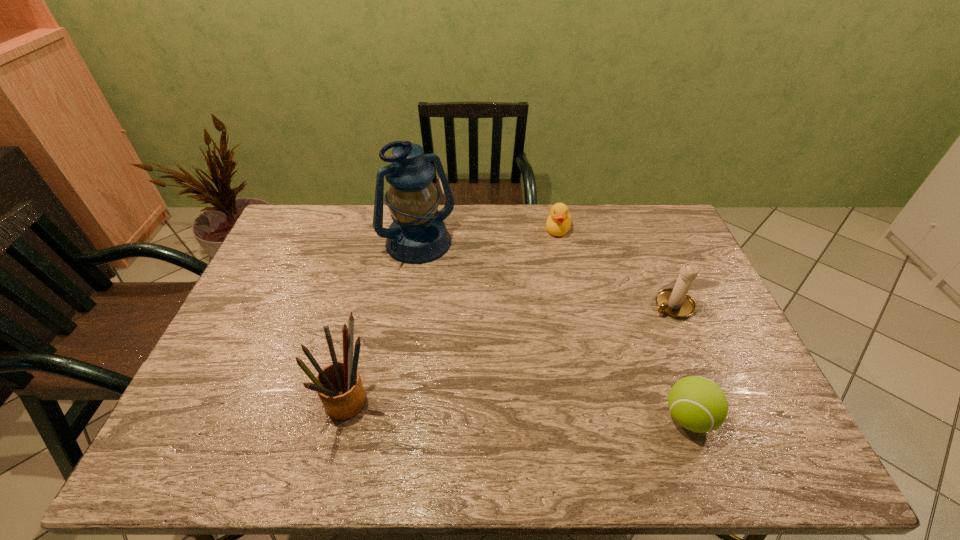
Where is `blank space located on the handle side of the third nearest object`? The image size is (960, 540). blank space located on the handle side of the third nearest object is located at coordinates (642, 324).

I want to click on vacant area situated 0.220m on the face of the tallest object, so click(x=468, y=311).

Find the location of `vacant space located 0.170m on the face of the tallest object`. vacant space located 0.170m on the face of the tallest object is located at coordinates (460, 301).

At what (x,y) coordinates should I click in order to perform the action: click on free space located 0.230m on the face of the tallest object. Please return your answer as a coordinate pair (x, y). Looking at the image, I should click on (469, 313).

At what (x,y) coordinates should I click in order to perform the action: click on vacant area situated 0.240m on the face of the third object from right to left. Please return your answer as a coordinate pair (x, y). The width and height of the screenshot is (960, 540). Looking at the image, I should click on (540, 286).

Where is `free space located on the face of the third object from right to left`? The width and height of the screenshot is (960, 540). free space located on the face of the third object from right to left is located at coordinates (531, 313).

Find the location of `vacant region located 0.350m on the face of the third object from right to left`. vacant region located 0.350m on the face of the third object from right to left is located at coordinates (532, 310).

Locate an element on the screen. The height and width of the screenshot is (540, 960). lantern that is positioned at the far edge is located at coordinates (417, 234).

I want to click on duckling that is at the far edge, so point(558,222).

You are a GUI agent. You are given a task and a screenshot of the screen. Output one action in this format:
    pyautogui.click(x=<x>, y=<y>)
    Task: Click on the pencil box located in the near edge section of the desktop
    The image size is (960, 540).
    Given the screenshot: What is the action you would take?
    pyautogui.click(x=339, y=386)